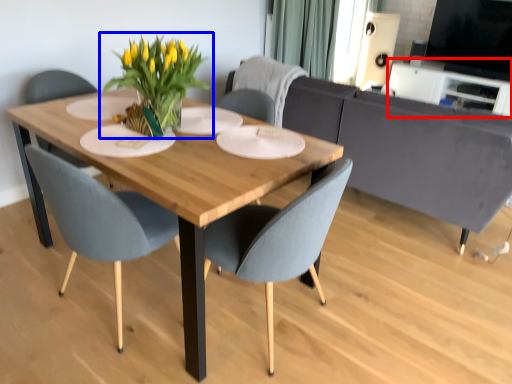
Question: Among these objects, which one is farthest to the camera, entertainment center (highlighted by a red box) or houseplant (highlighted by a blue box)?

Choices:
 (A) entertainment center
 (B) houseplant

Answer: (A)